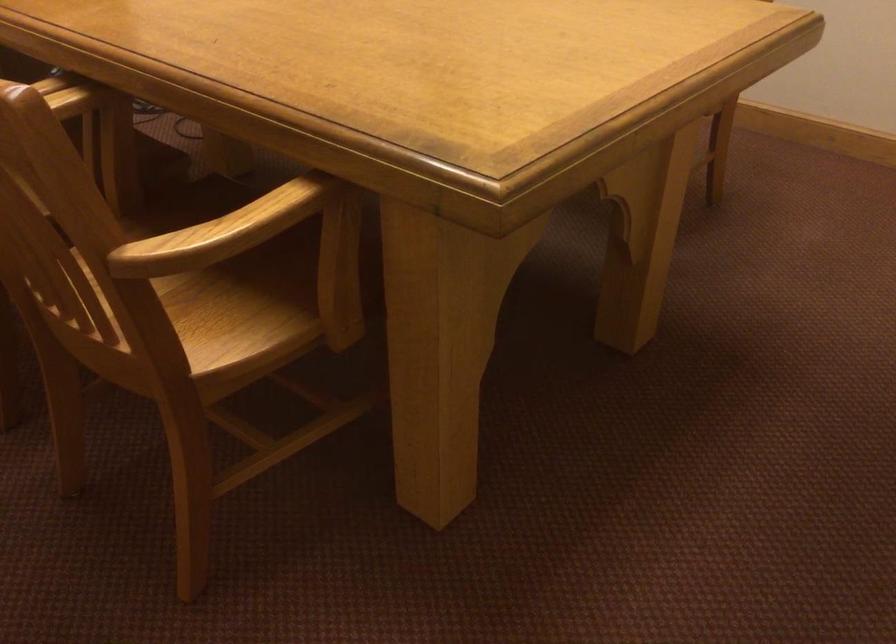
Describe the element at coordinates (227, 327) in the screenshot. I see `a chair sitting surface` at that location.